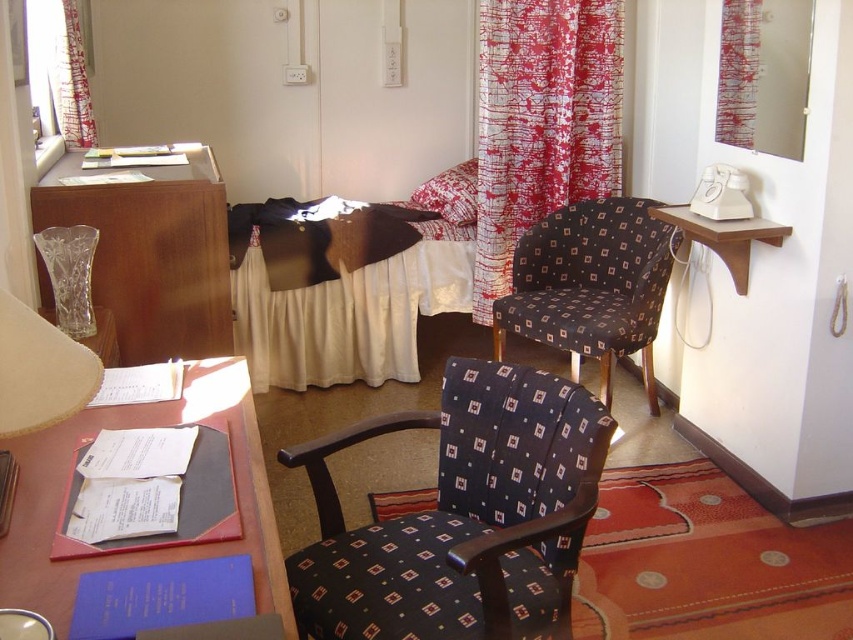
You are standing at the desk in the scene. There is a dark blue patterned swivel chair at center represented by point (462,516). Where would you need to walk to sit in the dark blue patterned swivel chair at center?

The dark blue patterned swivel chair at center is located at the coordinates (462,516), so you would need to walk to that point to sit in it.

What are the coordinates of the matte brown desk at lower left?

The coordinates of the matte brown desk at lower left are at point (148,548).

You are a guest in the hotel room and need to sit down to read the menu on the desk. The dark blue patterned swivel chair at center and the matte brown desk at lower left are in your way. Which object should you move to access the desk?

The dark blue patterned swivel chair at center is smaller than the matte brown desk at lower left, so you should move the dark blue patterned swivel chair at center to access the desk.